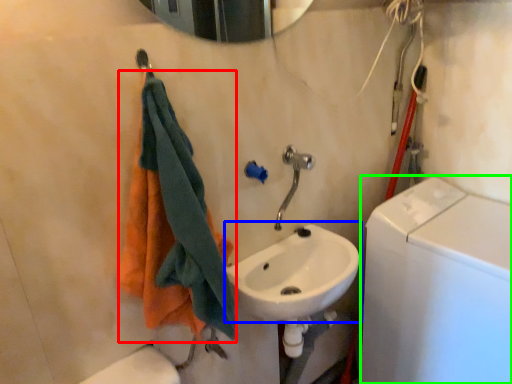
Question: Based on their relative distances, which object is farther from towel (highlighted by a red box)? Choose from sink (highlighted by a blue box) and washing machine (highlighted by a green box).

Choices:
 (A) sink
 (B) washing machine

Answer: (B)